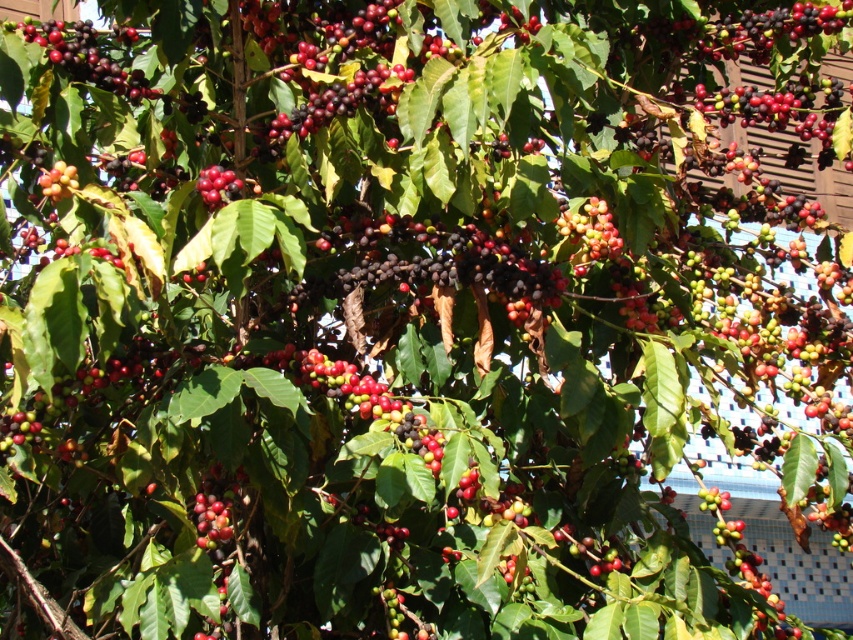
In the scene shown: Does shiny red berries at center appear over glossy red berry at upper left?

Indeed, shiny red berries at center is positioned over glossy red berry at upper left.

Who is higher up, shiny red berries at center or glossy red berry at upper left?

shiny red berries at center

This screenshot has height=640, width=853. Describe the element at coordinates (218, 186) in the screenshot. I see `shiny red berries at center` at that location.

This screenshot has width=853, height=640. I want to click on shiny red berries at center, so click(218, 186).

Is shiny dark red berries at upper left further to camera compared to glossy red berry at upper left?

Yes.

Is point (73, 64) behind point (44, 186)?

Yes, it is behind point (44, 186).

Where is `shiny dark red berries at upper left`? The width and height of the screenshot is (853, 640). shiny dark red berries at upper left is located at coordinates (86, 58).

Is shiny dark red berries at upper left taller than shiny red berries at center?

Correct, shiny dark red berries at upper left is much taller as shiny red berries at center.

Is shiny dark red berries at upper left above shiny red berries at center?

Indeed, shiny dark red berries at upper left is positioned over shiny red berries at center.

The image size is (853, 640). What do you see at coordinates (86, 58) in the screenshot?
I see `shiny dark red berries at upper left` at bounding box center [86, 58].

Find the location of a particular element. shiny dark red berries at upper left is located at coordinates (86, 58).